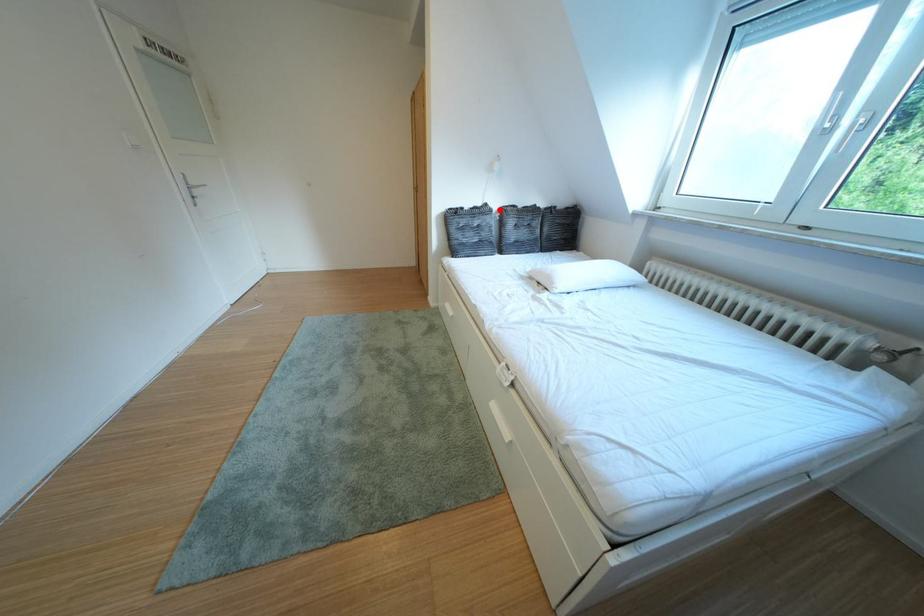
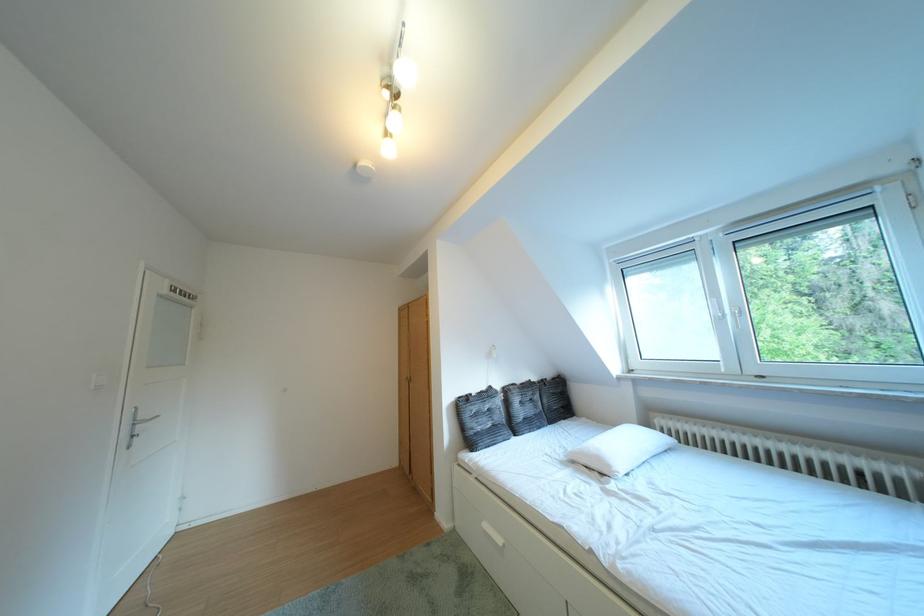
Where in the second image is the point corresponding to the highlighted location from the first image?

(504, 392)